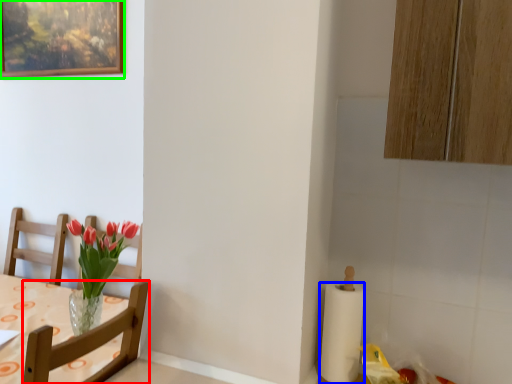
Question: Which object is positioned farthest from chair (highlighted by a red box)? Select from paper towel (highlighted by a blue box) and picture frame (highlighted by a green box).

Choices:
 (A) paper towel
 (B) picture frame

Answer: (B)